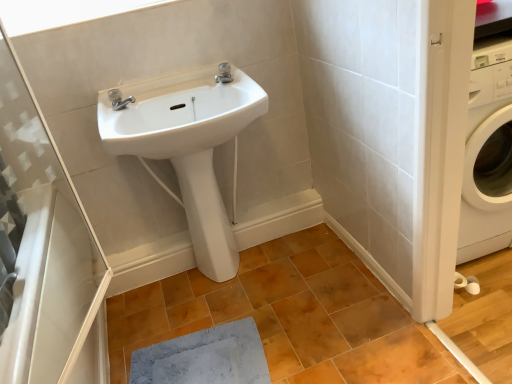
The width and height of the screenshot is (512, 384). Find the location of `vacant area that is situated to the right of white glossy bidet at center`. vacant area that is situated to the right of white glossy bidet at center is located at coordinates (265, 268).